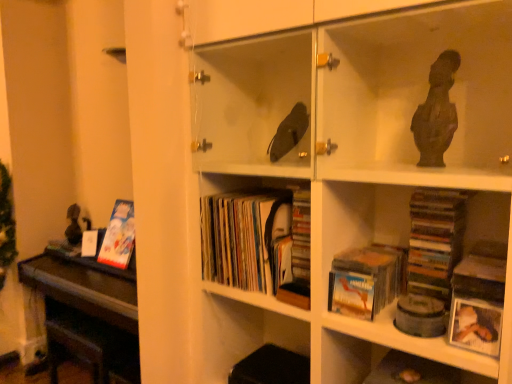
Question: Does white matte photo frame at lower right have a lesser width compared to matte cardboard book at left, which is the 3th book from front to back?

Choices:
 (A) no
 (B) yes

Answer: (B)

Question: From the image's perspective, would you say white matte photo frame at lower right is positioned over matte cardboard book at left, which is the 3th book from front to back?

Choices:
 (A) no
 (B) yes

Answer: (A)

Question: From a real-world perspective, is white matte photo frame at lower right on matte cardboard book at left, the 1th book positioned from the left?

Choices:
 (A) yes
 (B) no

Answer: (A)

Question: Is white matte photo frame at lower right looking in the opposite direction of matte cardboard book at left, which is the 3th book from front to back?

Choices:
 (A) no
 (B) yes

Answer: (A)

Question: Does white matte photo frame at lower right have a larger size compared to matte cardboard book at left, which is the 3th book from front to back?

Choices:
 (A) yes
 (B) no

Answer: (B)

Question: Looking at the image, does matte cardboard book at lower center, the third book viewed from the back, seem bigger or smaller compared to matte cardboard book at left, the 1th book positioned from the left?

Choices:
 (A) small
 (B) big

Answer: (A)

Question: In terms of height, does matte cardboard book at lower center, acting as the 1th book starting from the right, look taller or shorter compared to matte cardboard book at left, which is the 3th book from front to back?

Choices:
 (A) short
 (B) tall

Answer: (A)

Question: From a real-world perspective, is matte cardboard book at lower center, the third book viewed from the back, physically located above or below matte cardboard book at left, which is the 3th book from front to back?

Choices:
 (A) above
 (B) below

Answer: (A)

Question: Does point (396, 288) appear closer or farther from the camera than point (115, 225)?

Choices:
 (A) closer
 (B) farther

Answer: (A)

Question: Is matte cardboard book at left, arranged as the first book when viewed from the back, inside or outside of white matte photo frame at lower right?

Choices:
 (A) inside
 (B) outside

Answer: (B)

Question: In terms of width, does matte cardboard book at left, the 1th book positioned from the left, look wider or thinner when compared to white matte photo frame at lower right?

Choices:
 (A) wide
 (B) thin

Answer: (A)

Question: From the image's perspective, relative to white matte photo frame at lower right, is matte cardboard book at left, the 1th book positioned from the left, above or below?

Choices:
 (A) above
 (B) below

Answer: (A)

Question: Is matte cardboard book at left, the 1th book positioned from the left, to the left or to the right of white matte photo frame at lower right in the image?

Choices:
 (A) right
 (B) left

Answer: (B)

Question: Is point (477, 299) positioned closer to the camera than point (345, 268)?

Choices:
 (A) closer
 (B) farther

Answer: (A)

Question: In terms of height, does white matte photo frame at lower right look taller or shorter compared to matte cardboard book at lower center, the third book viewed from the back?

Choices:
 (A) short
 (B) tall

Answer: (A)